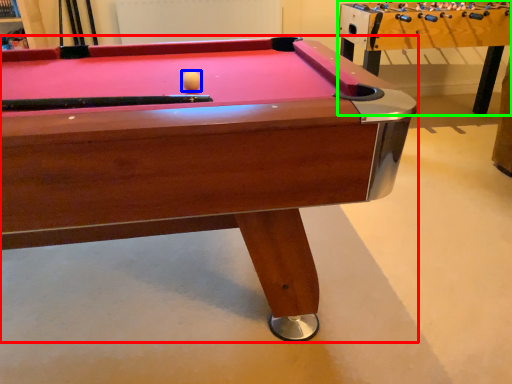
Question: Considering the real-world distances, which object is farthest from billiard table (highlighted by a red box)? ball (highlighted by a blue box) or table (highlighted by a green box)?

Choices:
 (A) ball
 (B) table

Answer: (B)